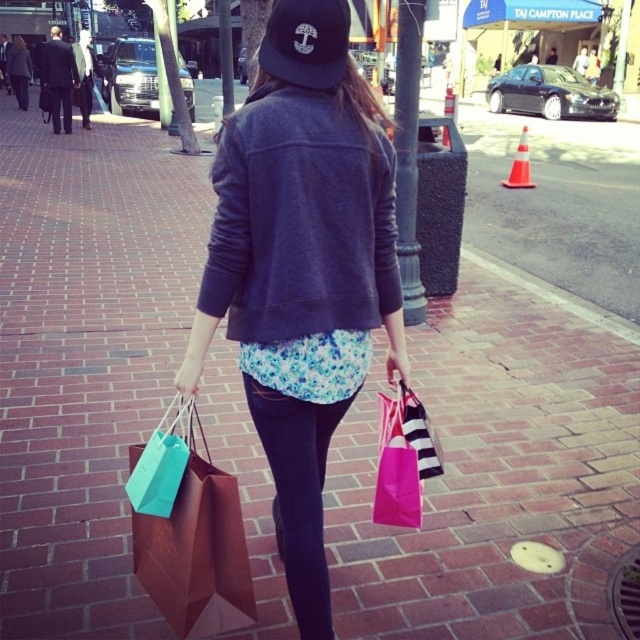
Question: Which point is closer to the camera taking this photo?

Choices:
 (A) (312, 493)
 (B) (179, 547)
 (C) (410, 225)
 (D) (276, 6)

Answer: (D)

Question: In this image, where is black metal pole at center located relative to pink paper bag at lower center?

Choices:
 (A) below
 (B) above

Answer: (B)

Question: Can you confirm if matte gray sweatshirt at center is positioned below teal paper bag at lower left?

Choices:
 (A) yes
 (B) no

Answer: (B)

Question: Which of the following is the farthest from the observer?

Choices:
 (A) black metal pole at center
 (B) pink paper bag at lower center
 (C) black matte baseball cap at upper center
 (D) teal paper bag at lower left

Answer: (A)

Question: Among these points, which one is nearest to the camera?

Choices:
 (A) coord(264,196)
 (B) coord(221,10)
 (C) coord(422,22)
 (D) coord(392,448)

Answer: (A)

Question: Does dark gray fleece sweatshirt at center have a larger size compared to black matte baseball cap at upper center?

Choices:
 (A) no
 (B) yes

Answer: (B)